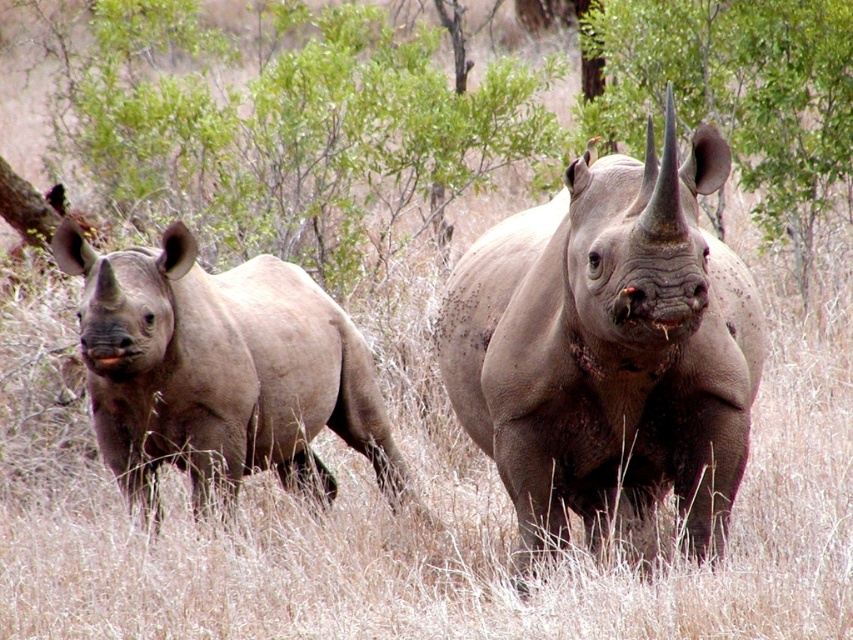
You are a wildlife photographer aiming to capture a clear photo of both the gray textured rhino at center and the matte gray rhino at left. Since you want to focus on the one closer to you, which rhino should you focus on?

The gray textured rhino at center is in front of the matte gray rhino at left, so you should focus on the gray textured rhino at center as it is closer to you.

You are a wildlife photographer trying to capture a photo of both the gray textured rhino at center and the matte gray rhino at left. You want to ensure both are visible in the frame. Based on their positions, which rhino should be positioned closer to the left edge of your camera frame?

The matte gray rhino at left should be positioned closer to the left edge of the camera frame because it is located to the left of the gray textured rhino at center.